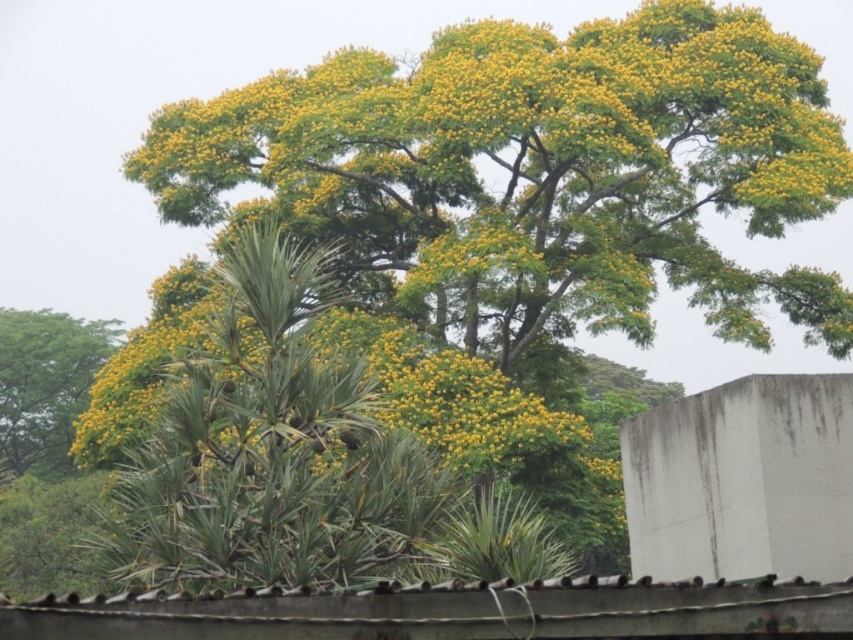
Which is more to the left, yellow-green foliage at center or yellow-green foliage at left?

From the viewer's perspective, yellow-green foliage at left appears more on the left side.

Is yellow-green foliage at center thinner than yellow-green foliage at left?

In fact, yellow-green foliage at center might be wider than yellow-green foliage at left.

Locate an element on the screen. yellow-green foliage at center is located at coordinates (535, 172).

Image resolution: width=853 pixels, height=640 pixels. In order to click on yellow-green foliage at center in this screenshot , I will do `click(535, 172)`.